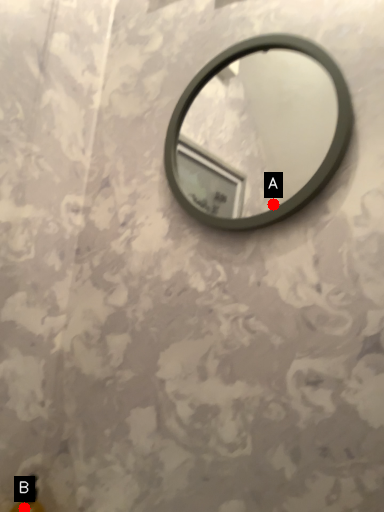
Question: Two points are circled on the image, labeled by A and B beside each circle. Which point is closer to the camera?

Choices:
 (A) A is closer
 (B) B is closer

Answer: (B)